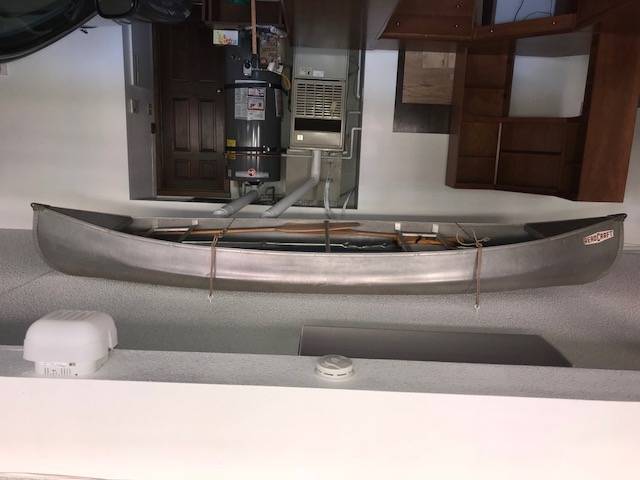
The height and width of the screenshot is (480, 640). I want to click on doorknob, so click(x=218, y=90).